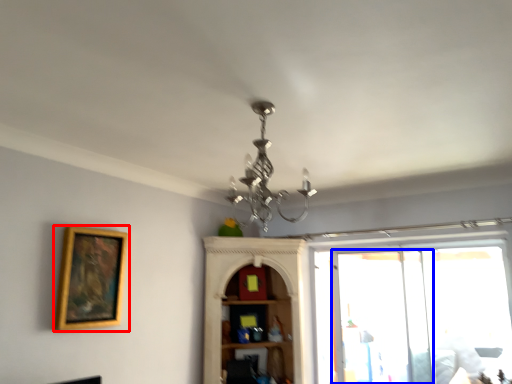
Question: Which object appears farthest to the camera in this image, picture frame (highlighted by a red box) or screen door (highlighted by a blue box)?

Choices:
 (A) picture frame
 (B) screen door

Answer: (B)